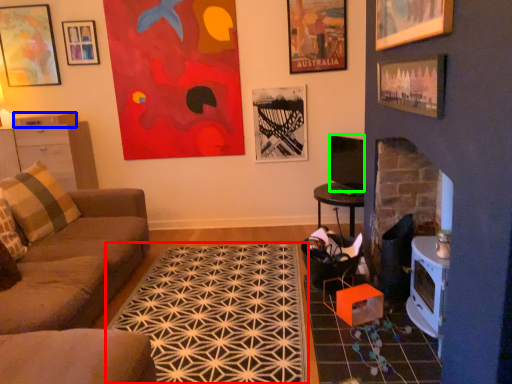
Question: Which is nearer to the mat (highlighted by a red box)? drawer (highlighted by a blue box) or television (highlighted by a green box).

Choices:
 (A) drawer
 (B) television

Answer: (B)